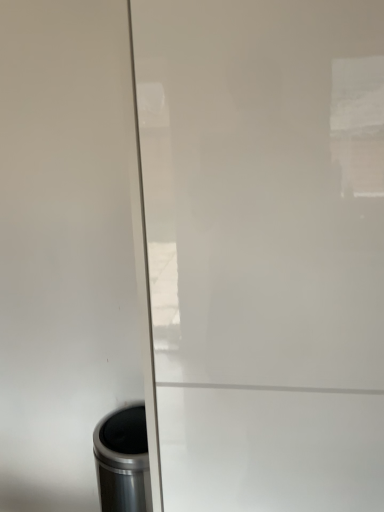
Question: Considering the positions of point (297, 136) and point (139, 503), is point (297, 136) closer or farther from the camera than point (139, 503)?

Choices:
 (A) closer
 (B) farther

Answer: (A)

Question: Is white glossy screen door at center inside or outside of metallic trash can at lower left?

Choices:
 (A) inside
 (B) outside

Answer: (B)

Question: Based on their sizes in the image, would you say white glossy screen door at center is bigger or smaller than metallic trash can at lower left?

Choices:
 (A) big
 (B) small

Answer: (A)

Question: From the image's perspective, is metallic trash can at lower left located above or below white glossy screen door at center?

Choices:
 (A) below
 (B) above

Answer: (A)

Question: From a real-world perspective, is metallic trash can at lower left positioned above or below white glossy screen door at center?

Choices:
 (A) above
 (B) below

Answer: (B)

Question: Looking at their shapes, would you say metallic trash can at lower left is wider or thinner than white glossy screen door at center?

Choices:
 (A) thin
 (B) wide

Answer: (A)

Question: Which is correct: metallic trash can at lower left is inside white glossy screen door at center, or outside of it?

Choices:
 (A) inside
 (B) outside

Answer: (B)